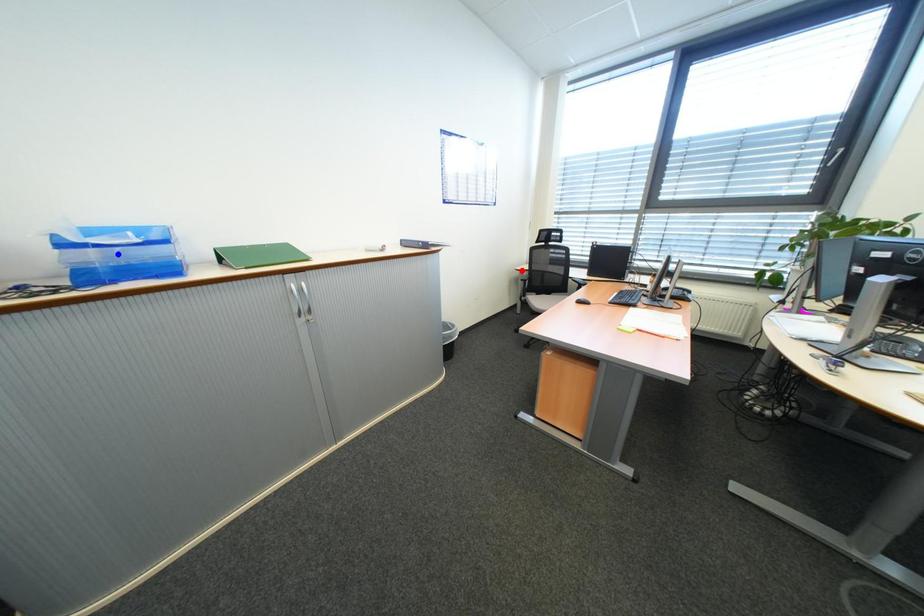
Question: In the image, two points are highlighted. Which point is nearer to the camera? Reply with the corresponding letter.

Choices:
 (A) blue point
 (B) red point

Answer: (A)